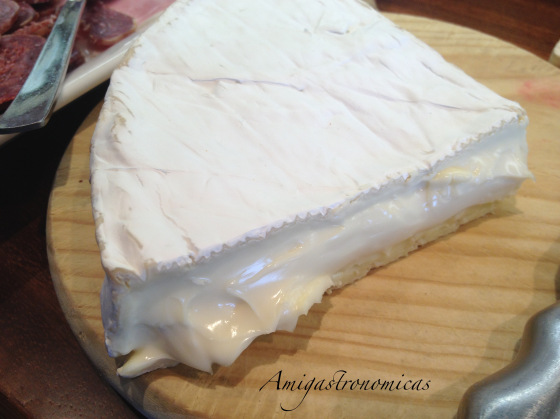
This screenshot has height=419, width=560. I want to click on brown wooden table, so click(x=38, y=370).